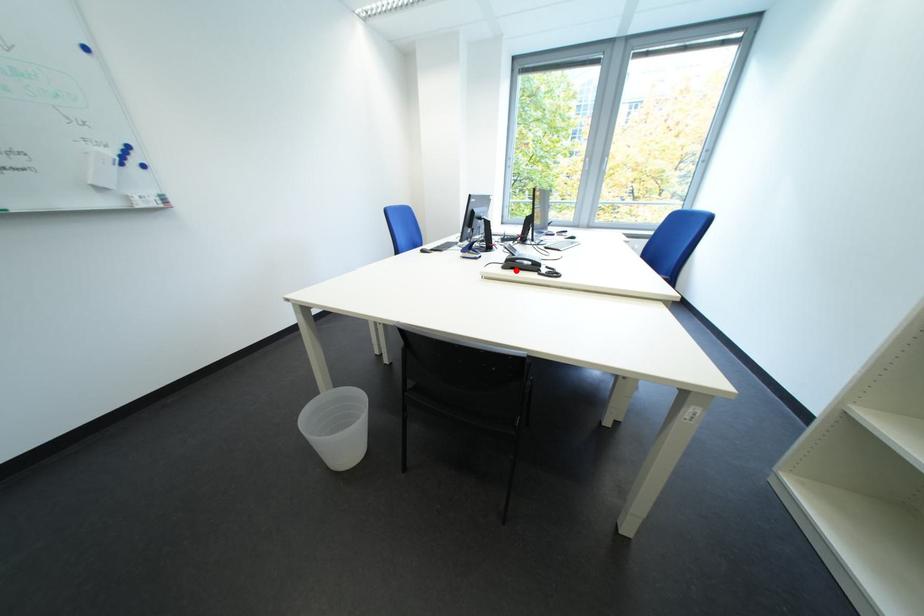
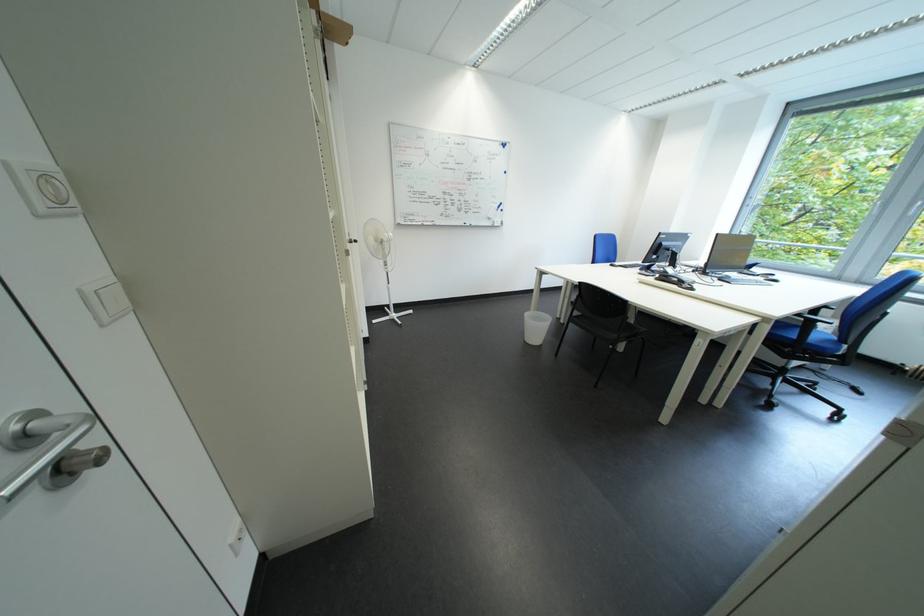
Question: I am providing you with two images of the same scene from different viewpoints. Image1 has a red point marked. In image2, the corresponding 3D location appears at what relative position? Reply with the corresponding letter.

Choices:
 (A) Closer
 (B) Farther

Answer: (A)